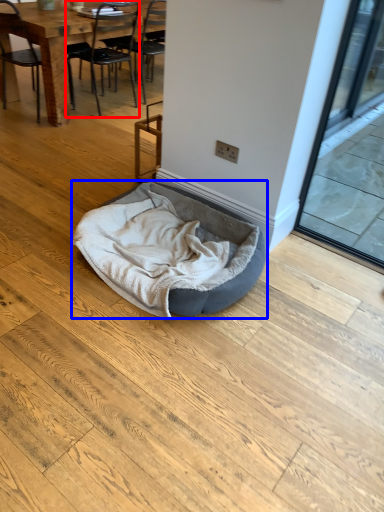
Question: Which object appears closest to the camera in this image, chair (highlighted by a red box) or dog bed (highlighted by a blue box)?

Choices:
 (A) chair
 (B) dog bed

Answer: (B)